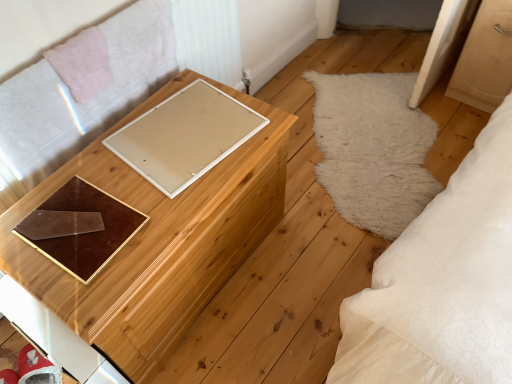
Question: Is brown glossy tray at center inside the boundaries of wooden chest at center, or outside?

Choices:
 (A) outside
 (B) inside

Answer: (A)

Question: Considering the positions of brown glossy tray at center and wooden chest at center in the image, is brown glossy tray at center wider or thinner than wooden chest at center?

Choices:
 (A) thin
 (B) wide

Answer: (A)

Question: Which object is positioned closest to the wooden chest at center?

Choices:
 (A) beige matte board at center
 (B) brown glossy tray at center

Answer: (A)

Question: Estimate the real-world distances between objects in this image. Which object is farther from the brown glossy tray at center?

Choices:
 (A) beige matte board at center
 (B) wooden chest at center

Answer: (A)